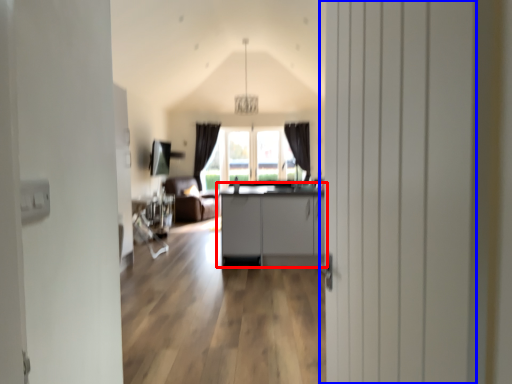
Question: Which object appears farthest to the camera in this image, cabinetry (highlighted by a red box) or door (highlighted by a blue box)?

Choices:
 (A) cabinetry
 (B) door

Answer: (A)